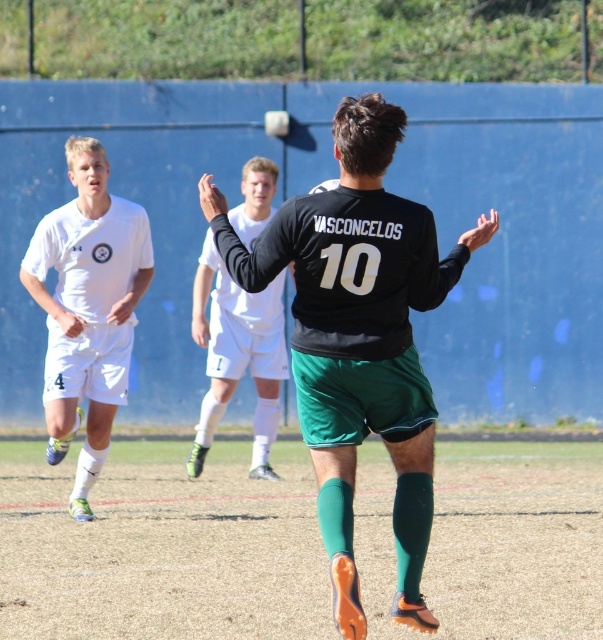
Does black matte jersey at center have a greater height compared to white matte soccer uniform at left?

Incorrect, black matte jersey at center's height is not larger of white matte soccer uniform at left's.

You are a GUI agent. You are given a task and a screenshot of the screen. Output one action in this format:
    pyautogui.click(x=<x>, y=<y>)
    Task: Click on the black matte jersey at center
    The image size is (603, 640).
    Given the screenshot: What is the action you would take?
    pyautogui.click(x=358, y=339)

Is point (423, 288) in front of point (63, 272)?

Yes, point (423, 288) is closer to viewer.

The height and width of the screenshot is (640, 603). Find the location of `black matte jersey at center`. black matte jersey at center is located at coordinates pyautogui.click(x=358, y=339).

Can you confirm if black matte jersey at center is shorter than white jersey at center?

In fact, black matte jersey at center may be taller than white jersey at center.

Can you confirm if black matte jersey at center is bigger than white jersey at center?

Indeed, black matte jersey at center has a larger size compared to white jersey at center.

Between point (350, 244) and point (254, 342), which one is positioned behind?

Point (254, 342)

The height and width of the screenshot is (640, 603). Find the location of `black matte jersey at center`. black matte jersey at center is located at coordinates (358, 339).

Does white matte soccer uniform at left come behind white jersey at center?

No.

From the picture: Does white matte soccer uniform at left come in front of white jersey at center?

That is True.

Is point (51, 320) more distant than point (250, 316)?

No, it is in front of (250, 316).

Find the location of `white matte soccer uniform at left`. white matte soccer uniform at left is located at coordinates (87, 308).